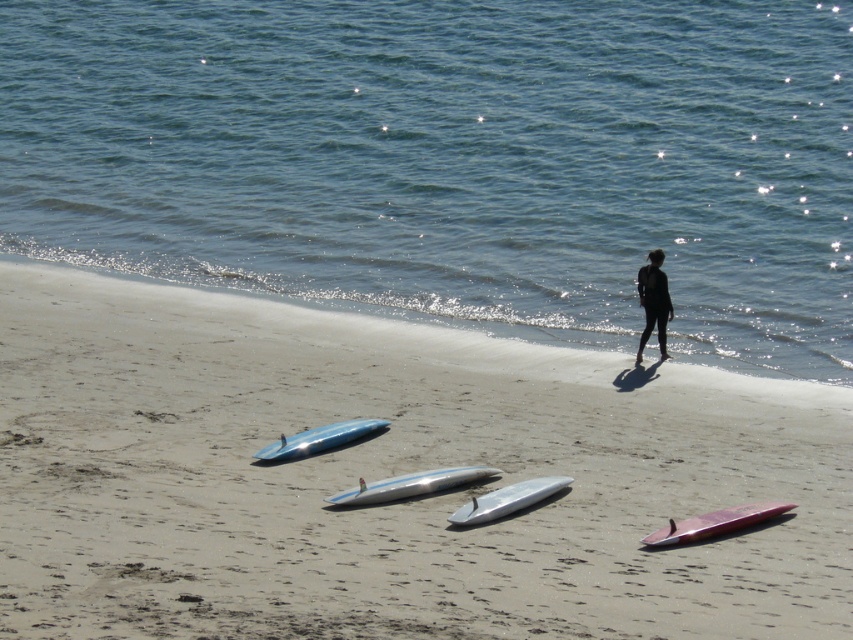
Is blue water at upper center closer to camera compared to shiny silver surfboard at center?

No, blue water at upper center is further to the viewer.

Does blue water at upper center lie behind shiny silver surfboard at center?

Yes, blue water at upper center is further from the viewer.

Is point (178, 260) behind point (502, 490)?

That is True.

In order to click on blue water at upper center in this screenshot , I will do `click(451, 161)`.

Between point (273, 442) and point (659, 272), which one is positioned behind?

Positioned behind is point (659, 272).

Does glossy blue surfboard at lower left have a lesser width compared to black matte wetsuit at center?

No.

Is point (352, 428) positioned after point (645, 273)?

No, it is not.

This screenshot has height=640, width=853. What are the coordinates of `glossy blue surfboard at lower left` in the screenshot? It's located at (318, 438).

From the picture: Which is above, glossy metallic surfboard at center or shiny pink surfboard at lower right?

glossy metallic surfboard at center is higher up.

Can you confirm if glossy metallic surfboard at center is positioned above shiny pink surfboard at lower right?

Correct, glossy metallic surfboard at center is located above shiny pink surfboard at lower right.

At what (x,y) coordinates should I click in order to perform the action: click on glossy metallic surfboard at center. Please return your answer as a coordinate pair (x, y). Looking at the image, I should click on (409, 484).